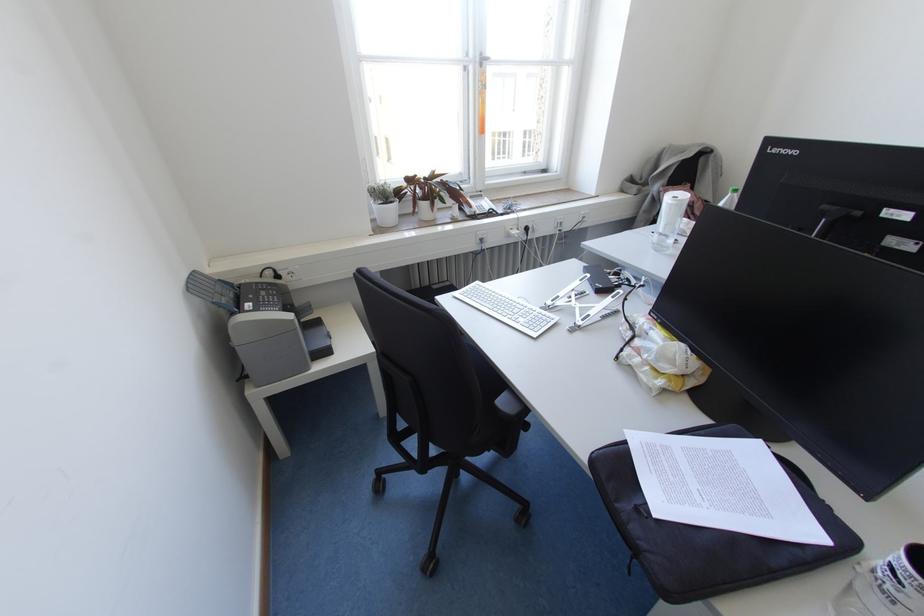
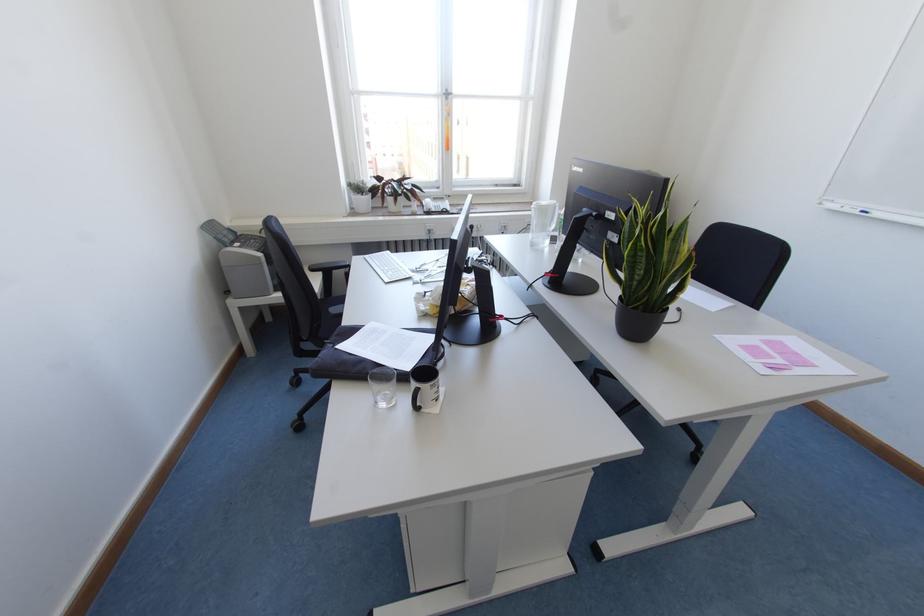
In the second image, find the point that corresponds to [670,241] in the first image.

(548, 240)